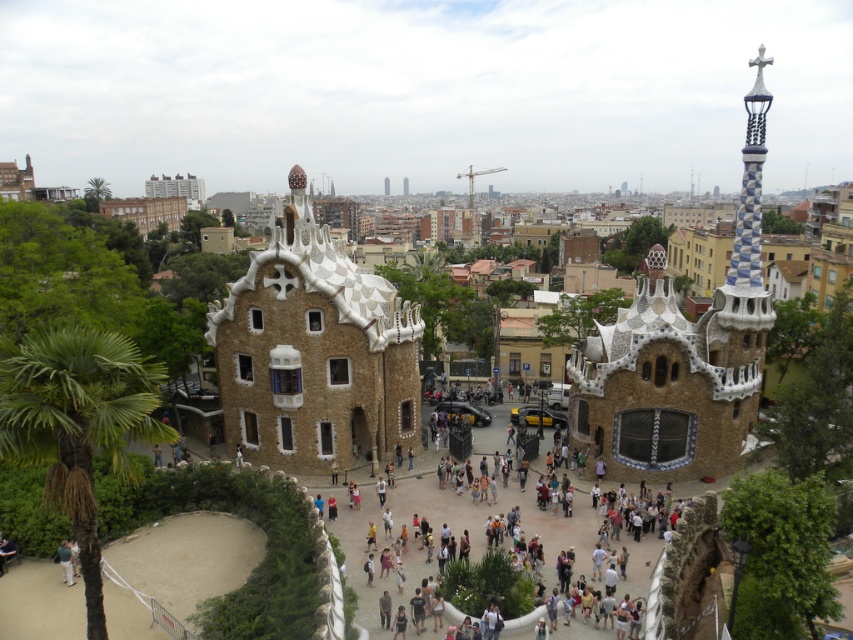
Question: Considering the relative positions of white mosaic building at center and green fabric shirt at lower left in the image provided, where is white mosaic building at center located with respect to green fabric shirt at lower left?

Choices:
 (A) right
 (B) left

Answer: (A)

Question: Can you confirm if white mosaic building at center is positioned above white mosaic church at center?

Choices:
 (A) no
 (B) yes

Answer: (B)

Question: Which point is closer to the camera?

Choices:
 (A) green fabric shirt at lower left
 (B) green leafy palm tree at lower left

Answer: (B)

Question: Which point appears closest to the camera in this image?

Choices:
 (A) (9, 432)
 (B) (366, 372)
 (C) (70, 560)

Answer: (A)

Question: Estimate the real-world distances between objects in this image. Which object is farther from the white mosaic building at center?

Choices:
 (A) white mosaic church at center
 (B) green fabric shirt at lower left
 (C) green leafy palm tree at lower left

Answer: (B)

Question: Does white mosaic church at center have a lesser width compared to green leafy palm tree at lower left?

Choices:
 (A) yes
 (B) no

Answer: (A)